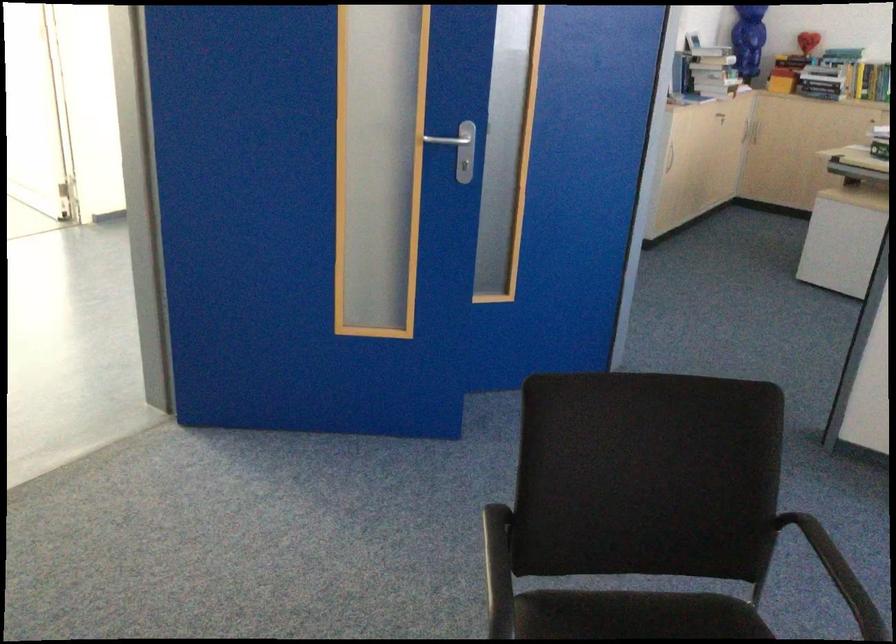
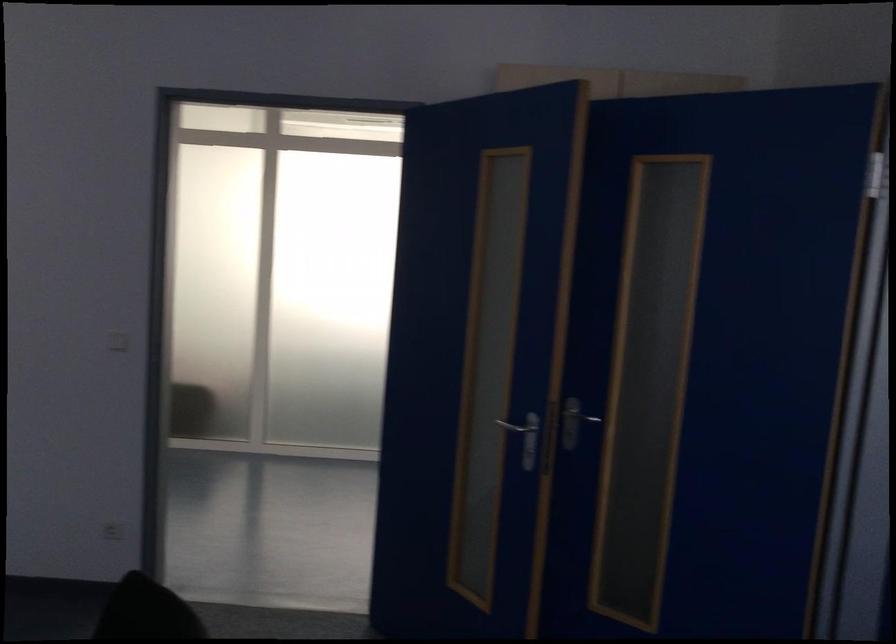
In the second image, find the point that corresponds to the point at 366,167 in the first image.

(528, 438)